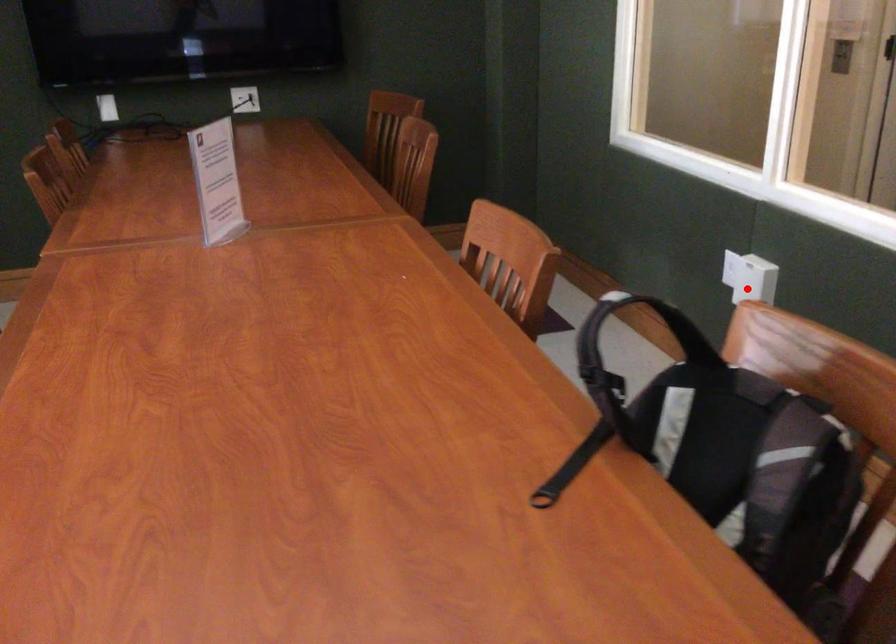
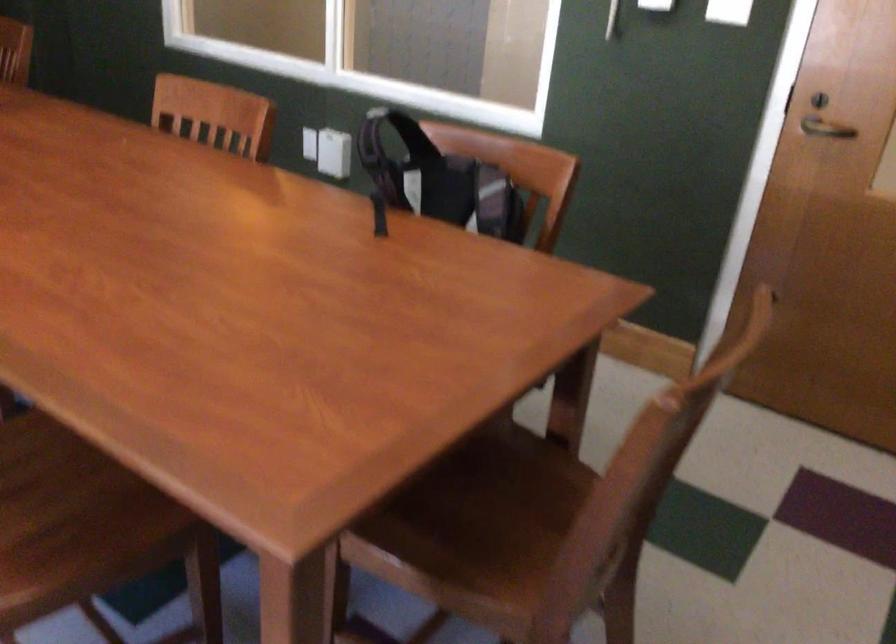
Question: I am providing you with two images of the same scene from different viewpoints. Given a red point in image1, look at the same physical point in image2. Is it:

Choices:
 (A) Closer to the viewpoint
 (B) Farther from the viewpoint

Answer: (B)